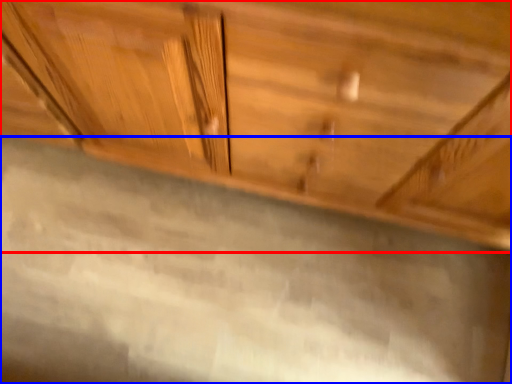
Question: Which object appears farthest to the camera in this image, cabinetry (highlighted by a red box) or granite (highlighted by a blue box)?

Choices:
 (A) cabinetry
 (B) granite

Answer: (B)